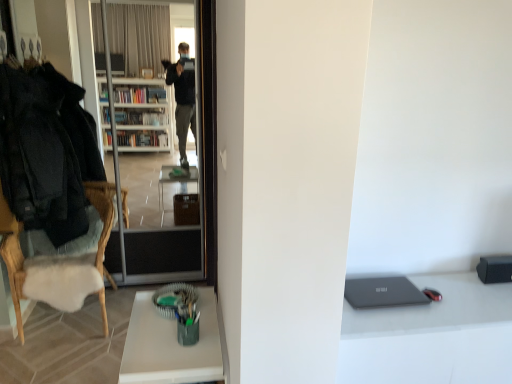
This screenshot has height=384, width=512. I want to click on unoccupied area in front of matte gray laptop at lower right, so click(x=396, y=325).